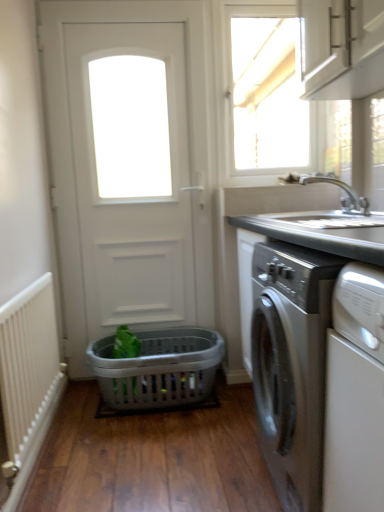
Question: Considering the positions of gray plastic laundry basket at center and silver metallic faucet at upper right in the image, is gray plastic laundry basket at center wider or thinner than silver metallic faucet at upper right?

Choices:
 (A) thin
 (B) wide

Answer: (B)

Question: Is point (178, 381) positioned closer to the camera than point (352, 200)?

Choices:
 (A) farther
 (B) closer

Answer: (A)

Question: Estimate the real-world distances between objects in this image. Which object is farther from the gray plastic laundry basket at center?

Choices:
 (A) white matte door at center
 (B) white textured radiator at left
 (C) silver metallic faucet at upper right
 (D) satin silver washing machine at right
 (E) white glossy window at upper center

Answer: (E)

Question: Which of these objects is positioned farthest from the white glossy window at upper center?

Choices:
 (A) white matte cabinet at upper right
 (B) white textured radiator at left
 (C) white matte door at center
 (D) gray plastic laundry basket at center
 (E) silver metallic faucet at upper right

Answer: (B)